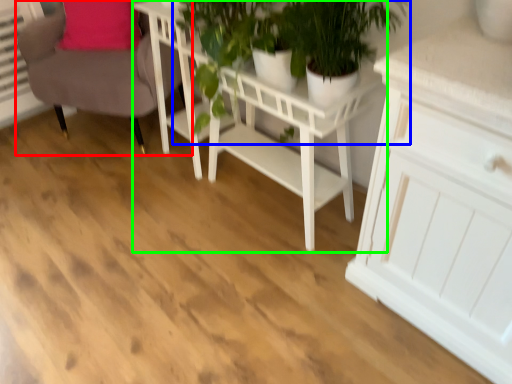
Question: Which is nearer to the chair (highlighted by a red box)? houseplant (highlighted by a blue box) or table (highlighted by a green box).

Choices:
 (A) houseplant
 (B) table

Answer: (B)